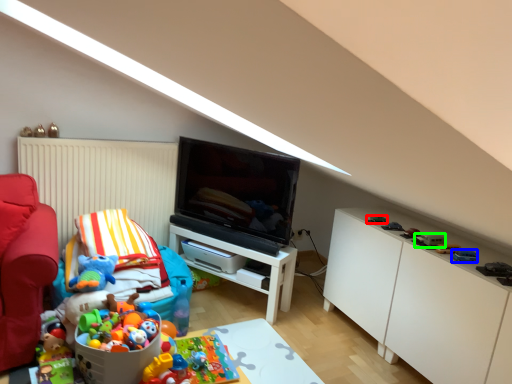
Question: Based on their relative distances, which object is nearer to toy (highlighted by a red box)? Choose from toy (highlighted by a blue box) and toy (highlighted by a green box).

Choices:
 (A) toy
 (B) toy

Answer: (B)